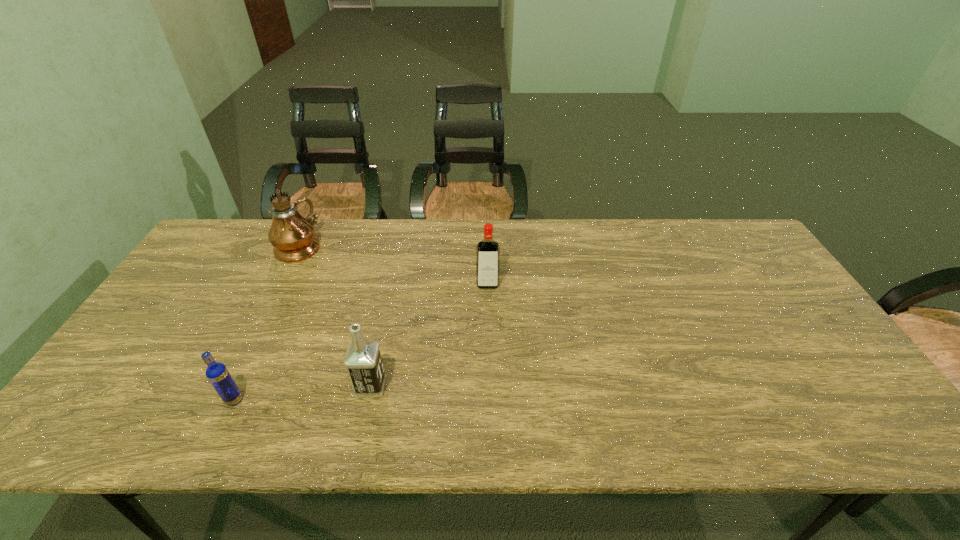
Identify the location of vodka that is the third closest one to the tallest object. (488, 250).

I want to click on blank area in the image that satisfies the following two spatial constraints: 1. on the front label of the second vodka from right to left; 2. on the front side of the shortest vodka, so click(x=368, y=400).

At what (x,y) coordinates should I click in order to perform the action: click on vacant region that satisfies the following two spatial constraints: 1. on the front side of the oil lamp; 2. on the right side of the leftmost vodka. Please return your answer as a coordinate pair (x, y). Looking at the image, I should click on (222, 400).

Locate an element on the screen. The width and height of the screenshot is (960, 540). free location that satisfies the following two spatial constraints: 1. on the front and back of the third nearest object; 2. on the front label of the second object from right to left is located at coordinates (490, 386).

This screenshot has width=960, height=540. What are the coordinates of `vacant area in the image that satisfies the following two spatial constraints: 1. on the front and back of the rightmost vodka; 2. on the front label of the second object from right to left` in the screenshot? It's located at (490, 386).